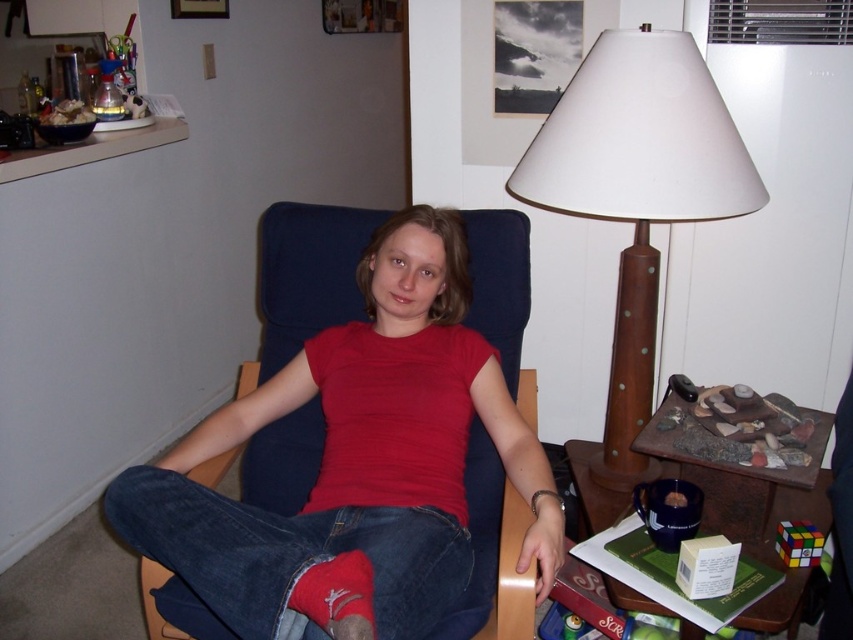
You are a delivery robot that needs to place a package between the denim at center and the red cotton sock at lower left. The package requires 8 inches of space. Can you fit it there?

The denim at center and red cotton sock at lower left are 7.52 inches apart from each other. Since the required space is 8 inches, the package cannot fit in that location.

Consider the image. You are trying to decide whether to place a new decorative item on the brown polished wood lamp at upper right or on the matte red shirt at center. Considering their sizes, which object would be more suitable for placing a small decorative item?

The matte red shirt at center is bigger than the brown polished wood lamp at upper right, so placing a small decorative item on the matte red shirt at center would be more suitable due to its larger surface area.

In the scene described, there is a person wearing a red t shirt and blue jeans sitting in a blue armchair. There is also a wooden side table to their right with a lamp and some rocks. If you were to draw a straight line from the center of the red shirt to the point at coordinate (357, 456), would that line pass through any objects mentioned in the scene?

The point at coordinate (357, 456) is where the matte red shirt at center is located, so drawing a line from the center of the red shirt to that point would not pass through any other objects since it is the same location.